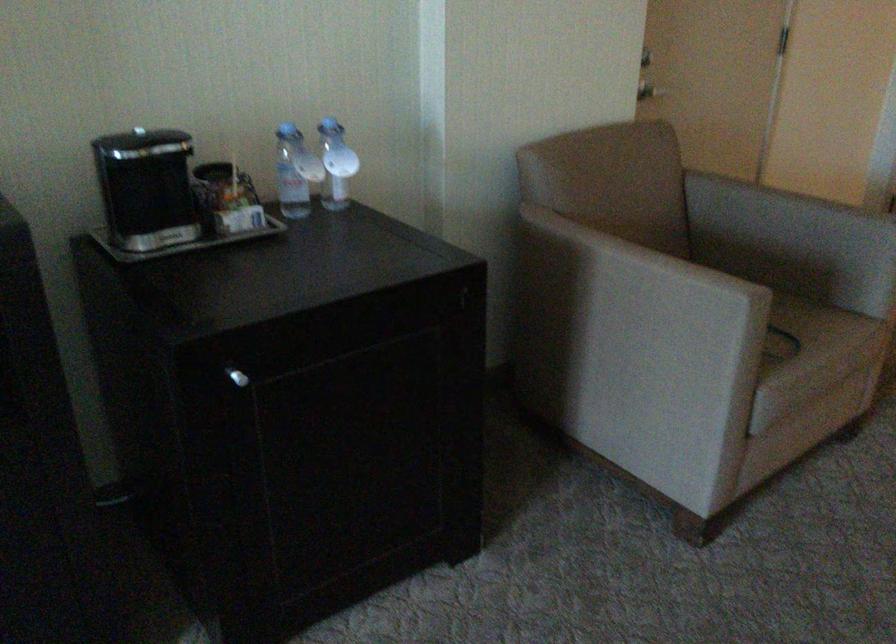
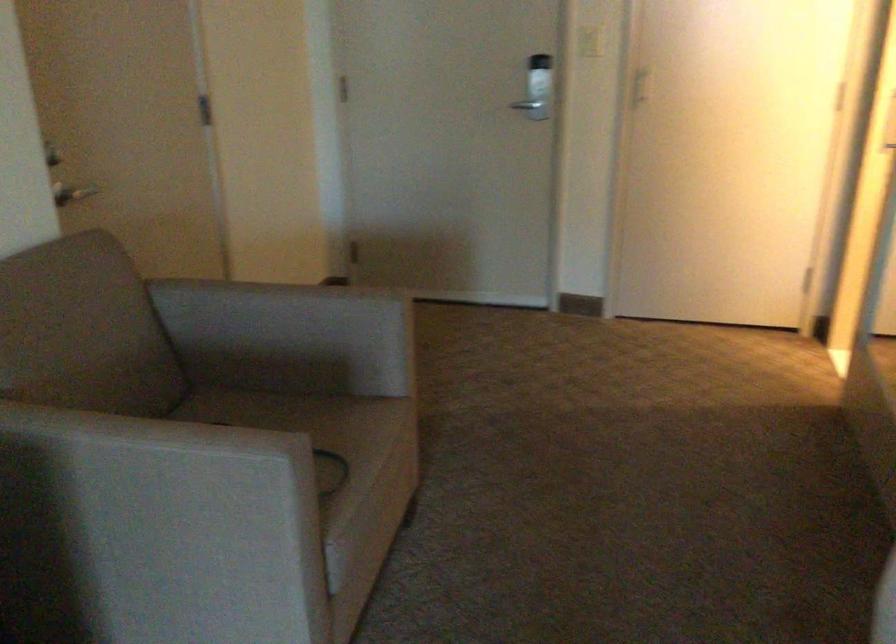
Question: The images are taken continuously from a first-person perspective. In which direction is your viewpoint rotating?

Choices:
 (A) Left
 (B) Right
 (C) Up
 (D) Down

Answer: (B)